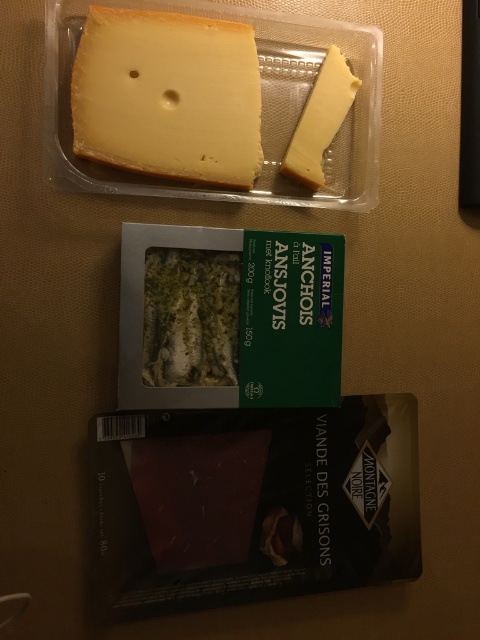
You are trying to stack the yellowish matte cheese at upper left and the yellow cheese at upper right on top of each other. Which one should you place at the bottom to ensure stability?

The yellowish matte cheese at upper left is taller than the yellow cheese at upper right, so placing the taller one at the bottom would provide a more stable base.